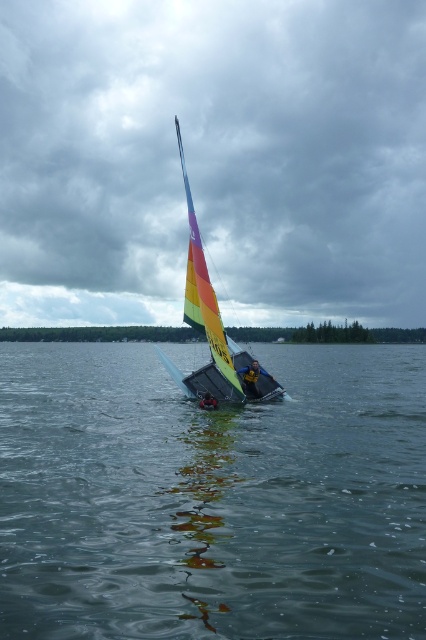
Question: Is clear water at sailboat center above rainbow sailboat at center?

Choices:
 (A) no
 (B) yes

Answer: (A)

Question: Does clear water at sailboat center appear under rainbow sailboat at center?

Choices:
 (A) no
 (B) yes

Answer: (B)

Question: Can you confirm if clear water at sailboat center is positioned above rainbow sailboat at center?

Choices:
 (A) yes
 (B) no

Answer: (B)

Question: Which object is closer to the camera taking this photo?

Choices:
 (A) rainbow sailboat at center
 (B) clear water at sailboat center

Answer: (B)